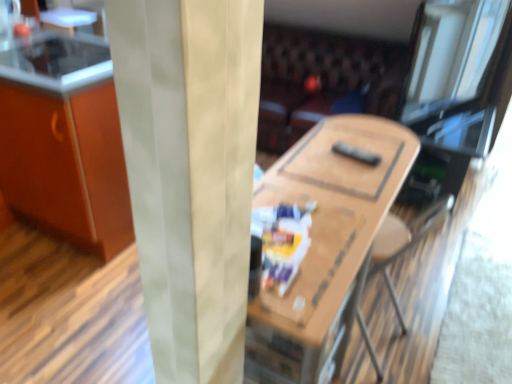
Locate an element on the screen. The image size is (512, 384). vacant area on top of wooden table at center (from a real-world perspective) is located at coordinates [x=330, y=186].